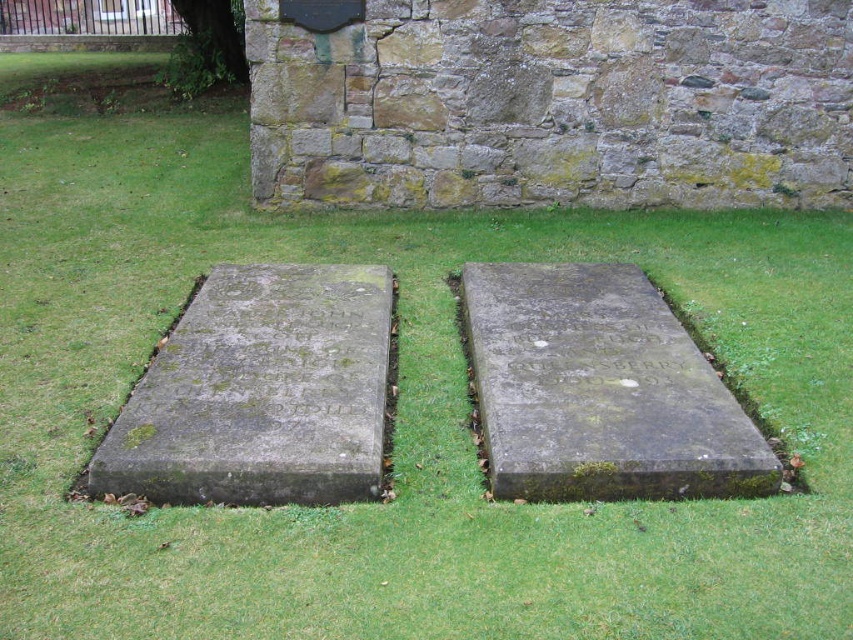
You are standing at the center of the image and want to walk towards the green mossy concrete at left. Which direction should you face to head directly towards it?

You should face towards the left direction to head directly towards the green mossy concrete at left since it is located at the left side of the image.

You are standing in a historic cemetery and see the green mossy concrete at left and the green mossy stone at center. Which one is positioned to the left?

The green mossy concrete at left is positioned to the left of the green mossy stone at center.